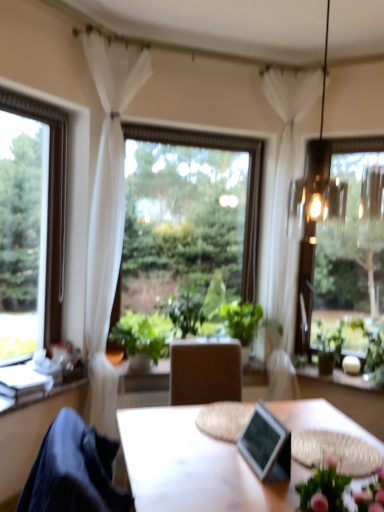
You are a GUI agent. You are given a task and a screenshot of the screen. Output one action in this format:
    pyautogui.click(x=<x>, y=<y>)
    Task: Click on the free region under green leafy plant at right, which is the third houseplant in left-to-right order (from a real-world perspective)
    The width and height of the screenshot is (384, 512).
    Given the screenshot: What is the action you would take?
    pyautogui.click(x=325, y=371)